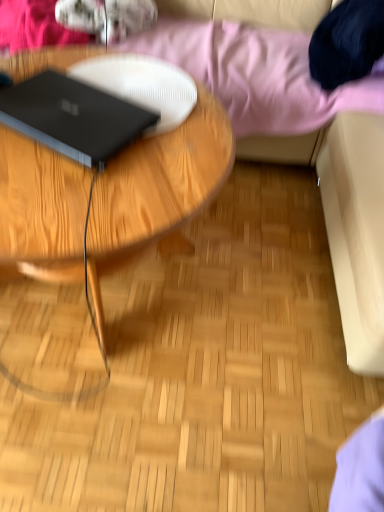
I want to click on free location to the right of black matte laptop at left, so click(x=175, y=159).